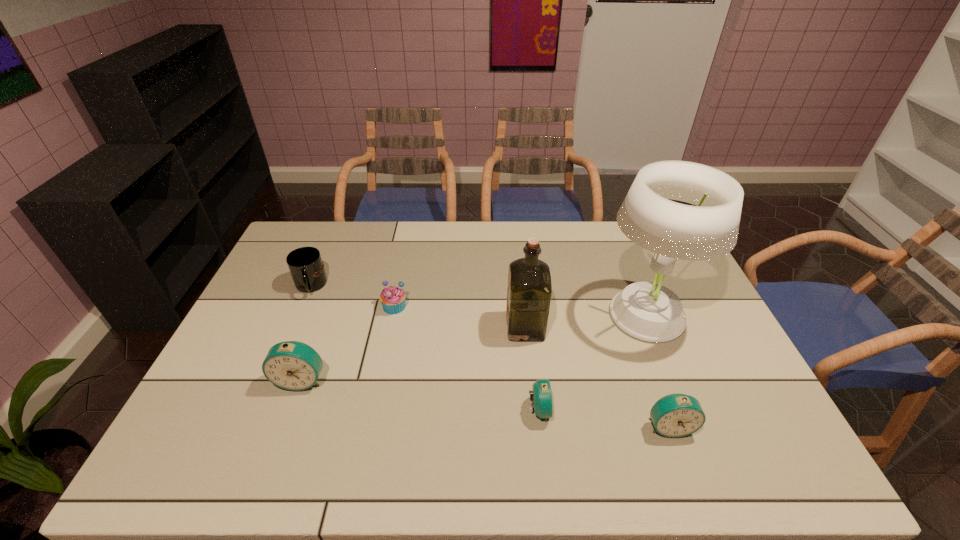
Where is `the fifth shortest object`? This screenshot has width=960, height=540. the fifth shortest object is located at coordinates (292, 365).

This screenshot has height=540, width=960. In order to click on the farthest alarm clock in this screenshot , I will do `click(292, 365)`.

Image resolution: width=960 pixels, height=540 pixels. I want to click on the shortest alarm clock, so click(x=542, y=396).

I want to click on the rightmost alarm clock, so click(x=676, y=415).

Identify the location of the sixth shortest object. (529, 290).

The height and width of the screenshot is (540, 960). I want to click on muffin, so click(x=392, y=298).

At what (x,y) coordinates should I click in order to perform the action: click on mug. Please return your answer as a coordinate pair (x, y). The height and width of the screenshot is (540, 960). Looking at the image, I should click on 305,264.

This screenshot has width=960, height=540. Find the location of `the tallest object`. the tallest object is located at coordinates (648, 311).

Locate an element on the screen. The image size is (960, 540). vacant space located 0.390m on the front-facing side of the shortest alarm clock is located at coordinates (705, 410).

Where is `vacant space located 0.350m on the label of the liquor`? vacant space located 0.350m on the label of the liquor is located at coordinates (390, 326).